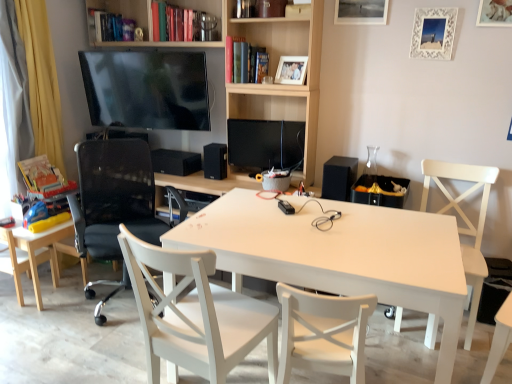
This screenshot has width=512, height=384. I want to click on white matte table at center, so click(340, 254).

Consider the image. Measure the distance between black mesh office chair at left, which is the 2th chair in left-to-right order, and camera.

black mesh office chair at left, which is the 2th chair in left-to-right order, and camera are 7.94 feet apart.

Describe the element at coordinates (240, 60) in the screenshot. I see `hardcover book at upper center, which is the second book from top to bottom` at that location.

In order to click on hardcover book at left, which is counted as the first book, starting from the left in this screenshot , I will do `click(41, 175)`.

Find the location of a particular element. black matte speaker at center, the 2th speaker in the left-to-right sequence is located at coordinates (215, 161).

The height and width of the screenshot is (384, 512). In order to click on white wood chair at center, the third chair from the left in this screenshot , I will do `click(196, 314)`.

Locate an element on the screen. hardcover book at upper left, the second book in the right-to-left sequence is located at coordinates (111, 26).

What do you see at coordinates (111, 26) in the screenshot?
I see `hardcover book at upper left, the second book in the right-to-left sequence` at bounding box center [111, 26].

Locate an element on the screen. This screenshot has width=512, height=384. white matte table at center is located at coordinates (340, 254).

Is light wood chair at left, which is the 4th chair in right-to-left order, turned away from black matte speaker at center, marked as the first speaker in a back-to-front arrangement?

light wood chair at left, which is the 4th chair in right-to-left order, does not have its back to black matte speaker at center, marked as the first speaker in a back-to-front arrangement.

Considering the relative sizes of light wood chair at left, the first chair in the left-to-right sequence, and black matte speaker at center, marked as the first speaker in a back-to-front arrangement, in the image provided, is light wood chair at left, the first chair in the left-to-right sequence, smaller than black matte speaker at center, marked as the first speaker in a back-to-front arrangement,?

No, light wood chair at left, the first chair in the left-to-right sequence, is not smaller than black matte speaker at center, marked as the first speaker in a back-to-front arrangement.

Consider the image. Who is more distant, light wood chair at left, which is the 4th chair in right-to-left order, or black matte speaker at center, which ranks as the 3th speaker in right-to-left order?

Positioned behind is black matte speaker at center, which ranks as the 3th speaker in right-to-left order.

Looking at this image, from a real-world perspective, which object rests below the other?

light wood chair at left, which is the 4th chair in right-to-left order, from a real-world perspective.

From a real-world perspective, which is physically above, black matte speaker at right, the first speaker when ordered from right to left, or metallic silver picture frame at upper center, positioned as the 2th picture frame in left-to-right order?

In real-world perspective, metallic silver picture frame at upper center, positioned as the 2th picture frame in left-to-right order, is above.

Considering the relative sizes of black matte speaker at right, positioned as the 1th speaker in front-to-back order, and metallic silver picture frame at upper center, positioned as the 2th picture frame in left-to-right order, in the image provided, is black matte speaker at right, positioned as the 1th speaker in front-to-back order, bigger than metallic silver picture frame at upper center, positioned as the 2th picture frame in left-to-right order,?

Correct, black matte speaker at right, positioned as the 1th speaker in front-to-back order, is larger in size than metallic silver picture frame at upper center, positioned as the 2th picture frame in left-to-right order.

How different are the orientations of black matte speaker at right, the 3th speaker viewed from the left, and metallic silver picture frame at upper center, which appears as the third picture frame when viewed from the right, in degrees?

There is a 1.24-degree angle between the facing directions of black matte speaker at right, the 3th speaker viewed from the left, and metallic silver picture frame at upper center, which appears as the third picture frame when viewed from the right.

Does black matte speaker at right, the first speaker when ordered from right to left, touch metallic silver picture frame at upper center, positioned as the 2th picture frame in left-to-right order?

No.

Consider the image. Which of these two, light wood chair at left, which is the 4th chair in right-to-left order, or white wood chair at right, which ranks as the 1th chair in right-to-left order, is smaller?

With smaller size is light wood chair at left, which is the 4th chair in right-to-left order.

Considering the sizes of objects light wood chair at left, which is the 4th chair in right-to-left order, and white wood chair at right, which ranks as the 1th chair in right-to-left order, in the image provided, who is wider, light wood chair at left, which is the 4th chair in right-to-left order, or white wood chair at right, which ranks as the 1th chair in right-to-left order,?

white wood chair at right, which ranks as the 1th chair in right-to-left order.

In the scene shown: Choose the correct answer: Is light wood chair at left, which is the 4th chair in right-to-left order, inside white wood chair at right, which ranks as the 1th chair in right-to-left order, or outside it?

light wood chair at left, which is the 4th chair in right-to-left order, is spatially situated outside white wood chair at right, which ranks as the 1th chair in right-to-left order.

Which object is further away from the camera, light wood chair at left, the first chair in the left-to-right sequence, or white wood chair at right, which ranks as the 1th chair in right-to-left order?

light wood chair at left, the first chair in the left-to-right sequence, is further from the camera.

How much distance is there between black matte speaker at center, marked as the first speaker in a back-to-front arrangement, and white wood chair at right, which ranks as the 1th chair in right-to-left order?

The distance of black matte speaker at center, marked as the first speaker in a back-to-front arrangement, from white wood chair at right, which ranks as the 1th chair in right-to-left order, is 1.77 meters.

Is black matte speaker at center, marked as the first speaker in a back-to-front arrangement, closer to camera compared to white wood chair at right, which ranks as the 1th chair in right-to-left order?

No.

Is black matte speaker at center, marked as the first speaker in a back-to-front arrangement, next to white wood chair at right, which ranks as the 1th chair in right-to-left order?

They are not placed beside each other.

Considering the relative positions of black matte speaker at center, which is counted as the 3th speaker, starting from the front, and white wood chair at right, which is the 4th chair from left to right, in the image provided, is black matte speaker at center, which is counted as the 3th speaker, starting from the front, to the left of white wood chair at right, which is the 4th chair from left to right, from the viewer's perspective?

Yes, black matte speaker at center, which is counted as the 3th speaker, starting from the front, is to the left of white wood chair at right, which is the 4th chair from left to right.

Locate an element on the screen. table in front of the light wood chair at left, which is the 4th chair in right-to-left order is located at coordinates (340, 254).

From the image's perspective, is light wood chair at left, which is the 4th chair in right-to-left order, positioned above or below white matte table at center?

light wood chair at left, which is the 4th chair in right-to-left order, is situated higher than white matte table at center in the image.

Can you confirm if light wood chair at left, which is the 4th chair in right-to-left order, is thinner than white matte table at center?

Correct, the width of light wood chair at left, which is the 4th chair in right-to-left order, is less than that of white matte table at center.

Consider the image. Can we say light wood chair at left, the first chair in the left-to-right sequence, lies outside white matte table at center?

light wood chair at left, the first chair in the left-to-right sequence, lies outside white matte table at center's area.

Considering the positions of point (300, 77) and point (485, 5), is point (300, 77) closer or farther from the camera than point (485, 5)?

Point (300, 77) appears to be farther away from the viewer than point (485, 5).

Is wooden photo frame at upper center, the 4th picture frame viewed from the right, not within wooden picture frame at upper right, the first picture frame viewed from the right?

wooden photo frame at upper center, the 4th picture frame viewed from the right, lies outside wooden picture frame at upper right, the first picture frame viewed from the right,'s area.

Could you tell me if wooden photo frame at upper center, marked as the first picture frame in a left-to-right arrangement, is turned towards wooden picture frame at upper right, marked as the 4th picture frame in a left-to-right arrangement?

No, wooden photo frame at upper center, marked as the first picture frame in a left-to-right arrangement, is not turned towards wooden picture frame at upper right, marked as the 4th picture frame in a left-to-right arrangement.

Considering the positions of objects wooden photo frame at upper center, marked as the first picture frame in a left-to-right arrangement, and wooden picture frame at upper right, the first picture frame viewed from the right, in the image provided, who is more to the right, wooden photo frame at upper center, marked as the first picture frame in a left-to-right arrangement, or wooden picture frame at upper right, the first picture frame viewed from the right,?

wooden picture frame at upper right, the first picture frame viewed from the right, is more to the right.

Locate an element on the screen. The width and height of the screenshot is (512, 384). television above the black matte speaker at center, which is the second speaker in right-to-left order (from a real-world perspective) is located at coordinates (146, 89).

From a real-world perspective, does matte black tv at upper center stand above black matte speaker at center, the 2th speaker in the left-to-right sequence?

Indeed, from a real-world perspective, matte black tv at upper center stands above black matte speaker at center, the 2th speaker in the left-to-right sequence.

Visually, is matte black tv at upper center positioned to the left or to the right of black matte speaker at center, which is the second speaker in right-to-left order?

In the image, matte black tv at upper center appears on the left side of black matte speaker at center, which is the second speaker in right-to-left order.

Considering the relative sizes of matte black tv at upper center and black matte speaker at center, marked as the 2th speaker in a front-to-back arrangement, in the image provided, is matte black tv at upper center shorter than black matte speaker at center, marked as the 2th speaker in a front-to-back arrangement,?

No, matte black tv at upper center is not shorter than black matte speaker at center, marked as the 2th speaker in a front-to-back arrangement.

From the image's perspective, which speaker is the 3rd one above the light wood chair at left, the first chair in the left-to-right sequence? Please provide its 2D coordinates.

[(175, 162)]

Which speaker is the 1st one when counting from the back of the metallic silver picture frame at upper center, positioned as the 2th picture frame in left-to-right order? Please provide its 2D coordinates.

[(339, 177)]

From the image, which object appears to be farther from white wood chair at right, which is the 4th chair from left to right, black matte speaker at center, positioned as the 1th speaker in left-to-right order, or black mesh office chair at left, which is the 2th chair in left-to-right order?

Among the two, black mesh office chair at left, which is the 2th chair in left-to-right order, is located further to white wood chair at right, which is the 4th chair from left to right.

Which object lies nearer to the anchor point black glossy monitor at center, black mesh office chair at left, which is the 2th chair in left-to-right order, or metallic silver picture frame at upper center, which appears as the third picture frame when viewed from the right?

black mesh office chair at left, which is the 2th chair in left-to-right order.

Consider the image. From the image, which object appears to be nearer to black matte speaker at right, the 3th speaker viewed from the left, wooden picture frame at upper right, the first picture frame viewed from the right, or hardcover book at upper center, which is the second book from top to bottom?

The object closer to black matte speaker at right, the 3th speaker viewed from the left, is hardcover book at upper center, which is the second book from top to bottom.

Estimate the real-world distances between objects in this image. Which object is closer to black matte speaker at center, marked as the 2th speaker in a front-to-back arrangement, black mesh office chair at left, placed as the third chair when sorted from right to left, or hardcover book at left, the third book when ordered from top to bottom?

black mesh office chair at left, placed as the third chair when sorted from right to left, is closer to black matte speaker at center, marked as the 2th speaker in a front-to-back arrangement.

Which object lies further to the anchor point wooden picture frame at upper right, marked as the 4th picture frame in a left-to-right arrangement, light wood chair at left, the first chair in the left-to-right sequence, or black matte speaker at right, positioned as the 3th speaker in back-to-front order?

light wood chair at left, the first chair in the left-to-right sequence, lies further to wooden picture frame at upper right, marked as the 4th picture frame in a left-to-right arrangement, than the other object.

Based on their spatial positions, is metallic silver picture frame at upper center, which appears as the third picture frame when viewed from the right, or black glossy monitor at center further from black matte speaker at center, positioned as the 1th speaker in left-to-right order?

Among the two, metallic silver picture frame at upper center, which appears as the third picture frame when viewed from the right, is located further to black matte speaker at center, positioned as the 1th speaker in left-to-right order.

Looking at the image, which one is located closer to hardcover book at upper left, arranged as the first book when viewed from the top, white wood chair at center, the third chair from the left, or white textured picture frame at upper right, the 2th picture frame when ordered from right to left?

Among the two, white textured picture frame at upper right, the 2th picture frame when ordered from right to left, is located nearer to hardcover book at upper left, arranged as the first book when viewed from the top.

Based on their spatial positions, is black matte speaker at center, which is the second speaker in right-to-left order, or hardcover book at upper center, which is the second book from top to bottom, further from hardcover book at left, the third book when ordered from top to bottom?

hardcover book at upper center, which is the second book from top to bottom, is positioned further to the anchor hardcover book at left, the third book when ordered from top to bottom.

You are a GUI agent. You are given a task and a screenshot of the screen. Output one action in this format:
    pyautogui.click(x=<x>, y=<y>)
    Task: Click on the television between hardcover book at left, which is counted as the first book, starting from the left, and black matte speaker at center, which is the 2th speaker in back-to-front order
    Image resolution: width=512 pixels, height=384 pixels.
    Given the screenshot: What is the action you would take?
    pyautogui.click(x=146, y=89)

The image size is (512, 384). In order to click on television located between white matte table at center and hardcover book at upper left, positioned as the second book in left-to-right order, in the depth direction in this screenshot , I will do `click(146, 89)`.

Identify the location of picture frame between matte black tv at upper center and black matte speaker at right, positioned as the 3th speaker in back-to-front order, in the horizontal direction. (291, 70).

Identify the location of computer monitor between wooden picture frame at upper right, marked as the 4th picture frame in a left-to-right arrangement, and white wood chair at right, which is the 4th chair from left to right, vertically. (266, 144).